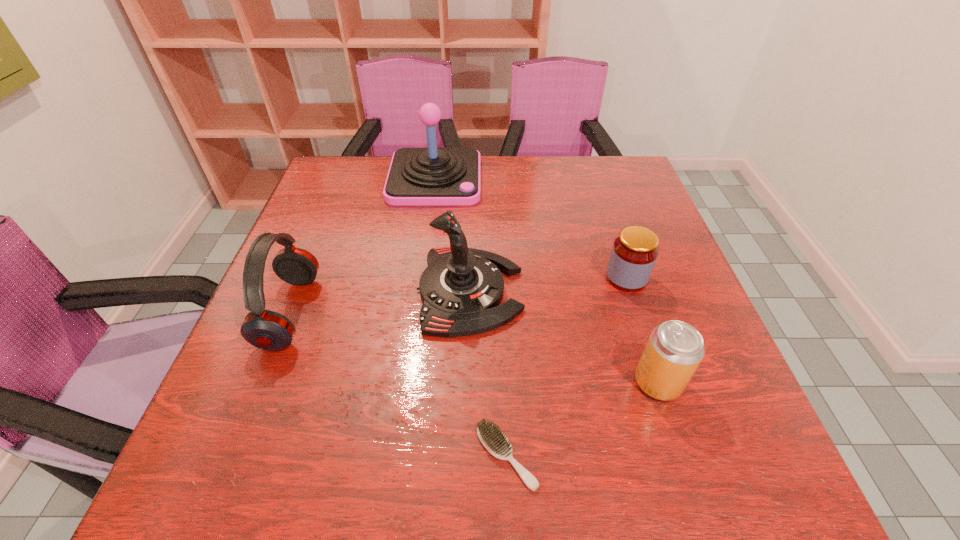
The width and height of the screenshot is (960, 540). I want to click on vacant area that lies between the fifth farthest object and the farther joystick, so click(546, 280).

What are the coordinates of `unoccupied position between the farthest object and the leftmost object` in the screenshot? It's located at (363, 246).

This screenshot has height=540, width=960. I want to click on vacant space that's between the nearer joystick and the second nearest object, so click(x=564, y=336).

You are a GUI agent. You are given a task and a screenshot of the screen. Output one action in this format:
    pyautogui.click(x=<x>, y=<y>)
    Task: Click on the free space between the leftmost object and the scrubbing brush
    
    Given the screenshot: What is the action you would take?
    pyautogui.click(x=398, y=384)

Locate an element on the screen. This screenshot has width=960, height=540. object that is the second closest to the pop (soda) is located at coordinates (493, 439).

Identify which object is the second nearest to the jar. Please provide its 2D coordinates. Your answer should be formatted as a tuple, i.e. [(x, y)], where the tuple contains the x and y coordinates of a point satisfying the conditions above.

[(461, 289)]

What are the coordinates of `free space that satisfies the following two spatial constraints: 1. on the ear cups of the earphone; 2. on the back side of the scrubbing brush` in the screenshot? It's located at (233, 456).

This screenshot has width=960, height=540. What are the coordinates of `free space that satisfies the following two spatial constraints: 1. on the back side of the scrubbing brush; 2. on the handle side of the nearer joystick` in the screenshot? It's located at (499, 291).

Find the location of a particular element. The image size is (960, 540). free space that satisfies the following two spatial constraints: 1. on the handle side of the nearer joystick; 2. on the right side of the second nearest object is located at coordinates (468, 382).

You are a GUI agent. You are given a task and a screenshot of the screen. Output one action in this format:
    pyautogui.click(x=<x>, y=<y>)
    Task: Click on the free location that satisfies the following two spatial constraints: 1. forward from the base of the farther joystick; 2. on the left side of the pop (soda)
    The image size is (960, 540).
    Given the screenshot: What is the action you would take?
    pyautogui.click(x=408, y=382)